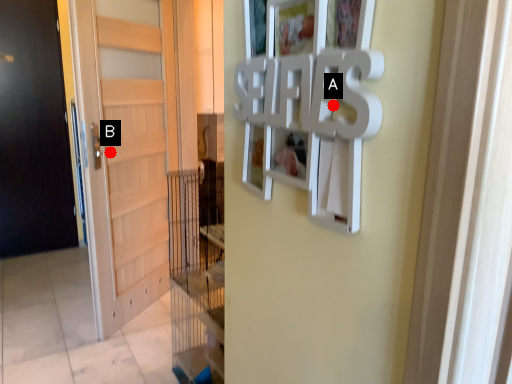
Question: Two points are circled on the image, labeled by A and B beside each circle. Which point is farther to the camera?

Choices:
 (A) A is further
 (B) B is further

Answer: (B)